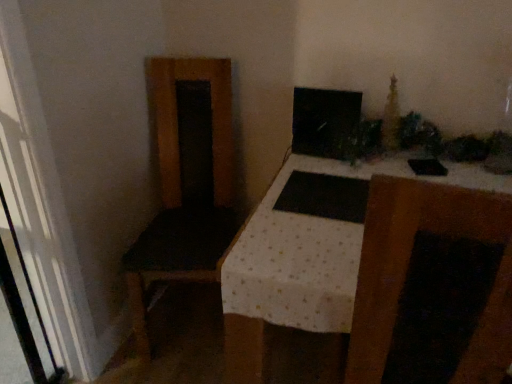
Question: Is matte black monitor at upper center bigger or smaller than white textured table at center?

Choices:
 (A) big
 (B) small

Answer: (B)

Question: From the image's perspective, is matte black monitor at upper center located above or below white textured table at center?

Choices:
 (A) below
 (B) above

Answer: (B)

Question: Is matte black monitor at upper center situated inside white textured table at center or outside?

Choices:
 (A) inside
 (B) outside

Answer: (B)

Question: Is white textured table at center inside or outside of matte black monitor at upper center?

Choices:
 (A) outside
 (B) inside

Answer: (A)

Question: Considering the positions of white textured table at center and matte black monitor at upper center in the image, is white textured table at center wider or thinner than matte black monitor at upper center?

Choices:
 (A) wide
 (B) thin

Answer: (A)

Question: Is point (487, 382) closer or farther from the camera than point (305, 112)?

Choices:
 (A) closer
 (B) farther

Answer: (A)

Question: From the image's perspective, is white textured table at center above or below matte black monitor at upper center?

Choices:
 (A) below
 (B) above

Answer: (A)